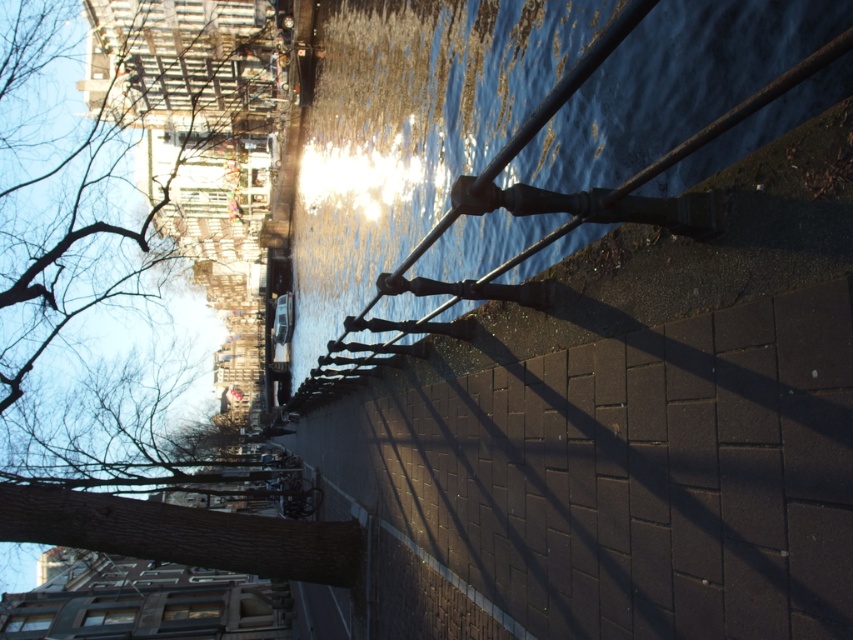
Between glossy water at center and brown rough tree at upper left, which one is positioned lower?

glossy water at center

Is point (459, 237) positioned before point (161, 152)?

Yes.

I want to click on glossy water at center, so click(x=521, y=157).